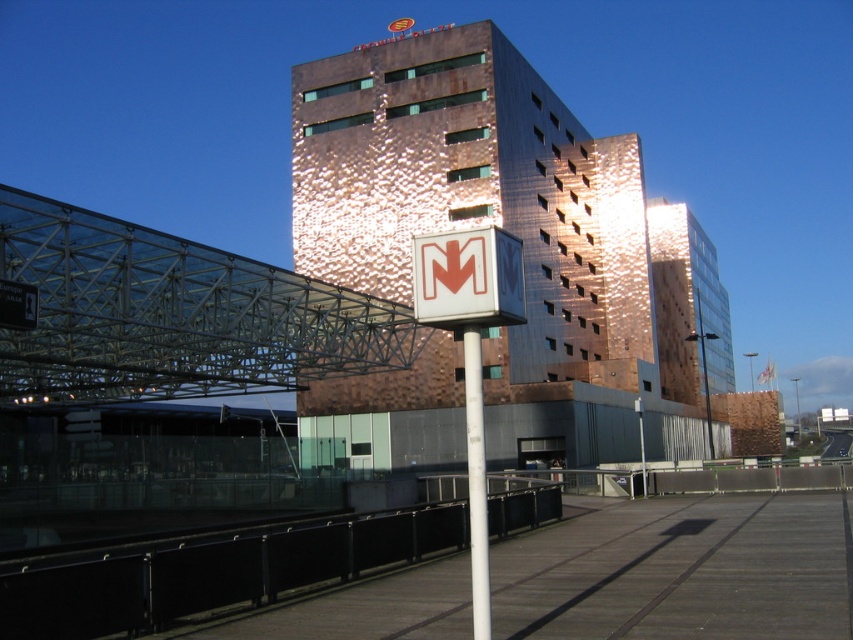
Can you confirm if copper hammered metal building at center is thinner than white plastic sign at center?

Incorrect, copper hammered metal building at center's width is not less than white plastic sign at center's.

Who is more forward, (378, 163) or (456, 285)?

Point (456, 285) is in front.

Image resolution: width=853 pixels, height=640 pixels. I want to click on copper hammered metal building at center, so click(485, 221).

Is the position of copper hammered metal building at center more distant than that of copper textured building at center?

No.

Is copper hammered metal building at center wider than copper textured building at center?

No, copper hammered metal building at center is not wider than copper textured building at center.

Describe the element at coordinates (485, 221) in the screenshot. I see `copper hammered metal building at center` at that location.

Locate an element on the screen. This screenshot has height=640, width=853. copper hammered metal building at center is located at coordinates coord(485,221).

Which is in front, point (717, 355) or point (471, 358)?

Positioned in front is point (471, 358).

Which of these two, copper textured building at center or white glossy pole at center, stands taller?

Standing taller between the two is copper textured building at center.

Is point (698, 275) more distant than point (477, 504)?

Yes, it is behind point (477, 504).

Find the location of a particular element. The height and width of the screenshot is (640, 853). copper textured building at center is located at coordinates (688, 305).